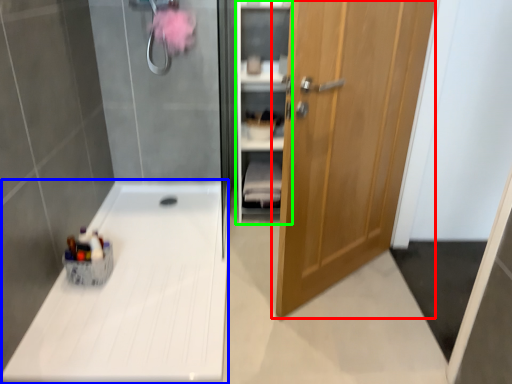
Question: Considering the real-world distances, which object is farthest from door (highlighted by a red box)? counter top (highlighted by a blue box) or cabinet (highlighted by a green box)?

Choices:
 (A) counter top
 (B) cabinet

Answer: (A)